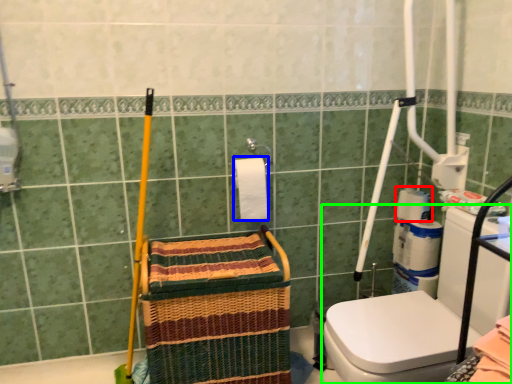
Question: Considering the real-world distances, which object is closest to toilet paper (highlighted by a red box)? toilet paper (highlighted by a blue box) or washer (highlighted by a green box).

Choices:
 (A) toilet paper
 (B) washer

Answer: (B)